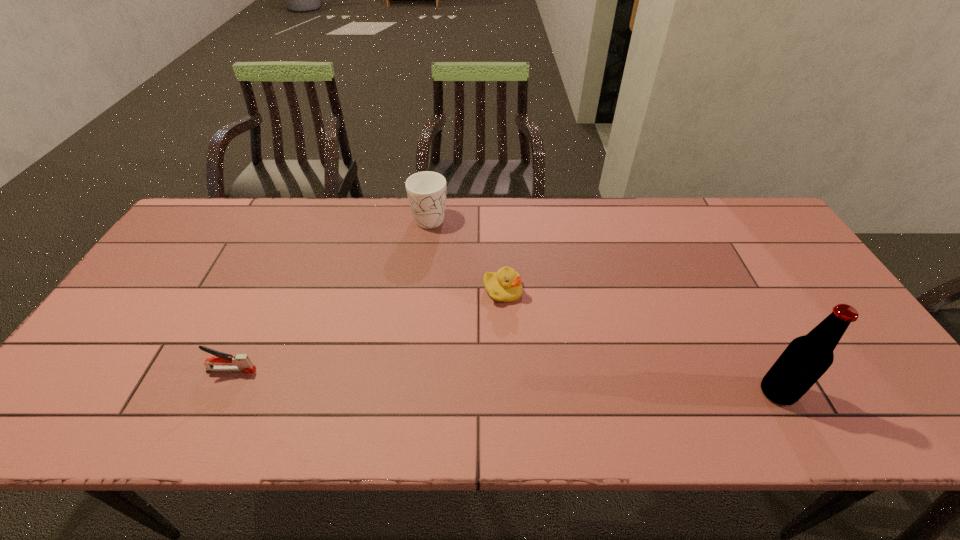
I want to click on vacant region located 0.310m on the side of the mug with the handle, so click(455, 302).

Locate an element on the screen. The height and width of the screenshot is (540, 960). vacant region located 0.330m on the side of the mug with the handle is located at coordinates (456, 308).

Locate an element on the screen. free space located on the side of the mug with the handle is located at coordinates (444, 266).

Identify the location of vacant space located 0.290m on the front-facing side of the duckling. The height and width of the screenshot is (540, 960). (579, 389).

Locate an element on the screen. The width and height of the screenshot is (960, 540). free region located 0.280m on the front-facing side of the duckling is located at coordinates (576, 386).

I want to click on free space located on the front-facing side of the duckling, so click(x=531, y=328).

Where is `object located in the far edge section of the desktop`? object located in the far edge section of the desktop is located at coordinates (426, 191).

You are a GUI agent. You are given a task and a screenshot of the screen. Output one action in this format:
    pyautogui.click(x=<x>, y=<y>)
    Task: Click on the stapler positioned at the near edge
    This screenshot has width=960, height=540.
    Given the screenshot: What is the action you would take?
    pyautogui.click(x=242, y=363)

The image size is (960, 540). I want to click on beer bottle that is at the near edge, so click(x=806, y=358).

Where is `free space at the far edge of the desktop`? This screenshot has height=540, width=960. free space at the far edge of the desktop is located at coordinates tap(579, 231).